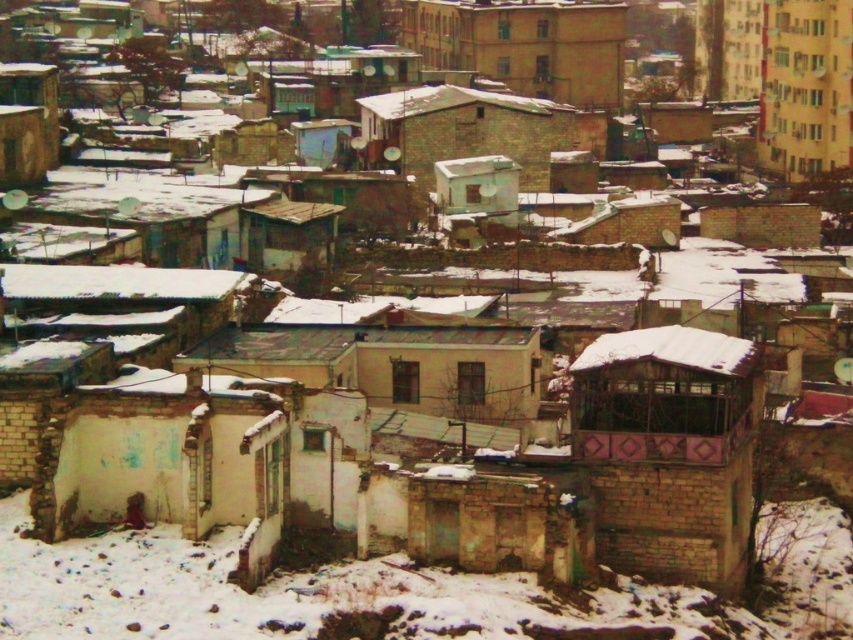
Which is below, brown brick hut at center-right or brown brick hut at center?

brown brick hut at center-right

Is brown brick hut at center-right to the left of brown brick hut at center from the viewer's perspective?

Incorrect, brown brick hut at center-right is not on the left side of brown brick hut at center.

Between point (693, 577) and point (402, 100), which one is positioned in front?

Point (693, 577) is in front.

I want to click on brown brick hut at center-right, so click(x=669, y=451).

Is brown brick hut at center-right below beige concrete building at upper center?

Yes, brown brick hut at center-right is below beige concrete building at upper center.

Is brown brick hut at center-right above beige concrete building at upper center?

No, brown brick hut at center-right is not above beige concrete building at upper center.

Who is more forward, (578, 460) or (537, 38)?

Point (578, 460) is in front.

Locate an element on the screen. Image resolution: width=853 pixels, height=640 pixels. brown brick hut at center-right is located at coordinates (669, 451).

Describe the element at coordinates (525, 45) in the screenshot. This screenshot has height=640, width=853. I see `beige concrete building at upper center` at that location.

Consider the image. How distant is beige concrete building at upper center from brown brick hut at center?

beige concrete building at upper center is 22.80 meters from brown brick hut at center.

The image size is (853, 640). I want to click on beige concrete building at upper center, so click(x=525, y=45).